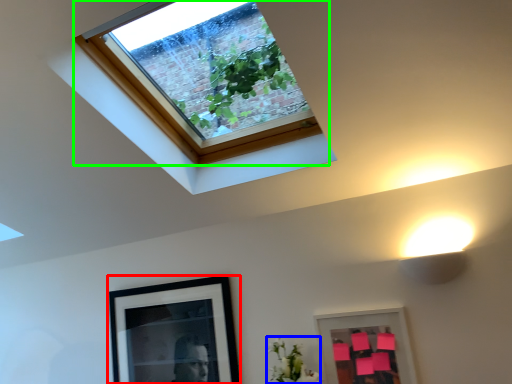
Question: Considering the real-world distances, which object is farthest from picture frame (highlighted by a red box)? flower (highlighted by a blue box) or window (highlighted by a green box)?

Choices:
 (A) flower
 (B) window

Answer: (B)